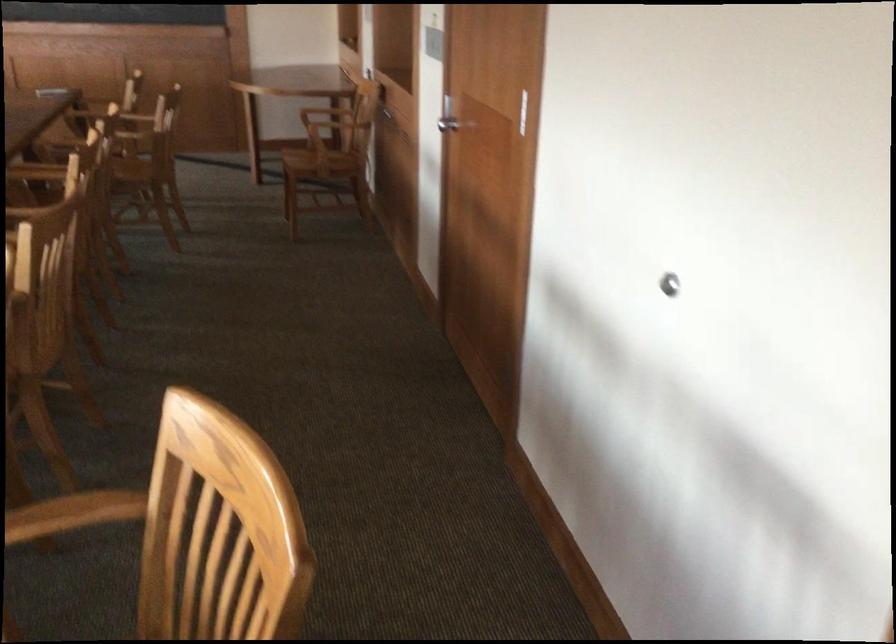
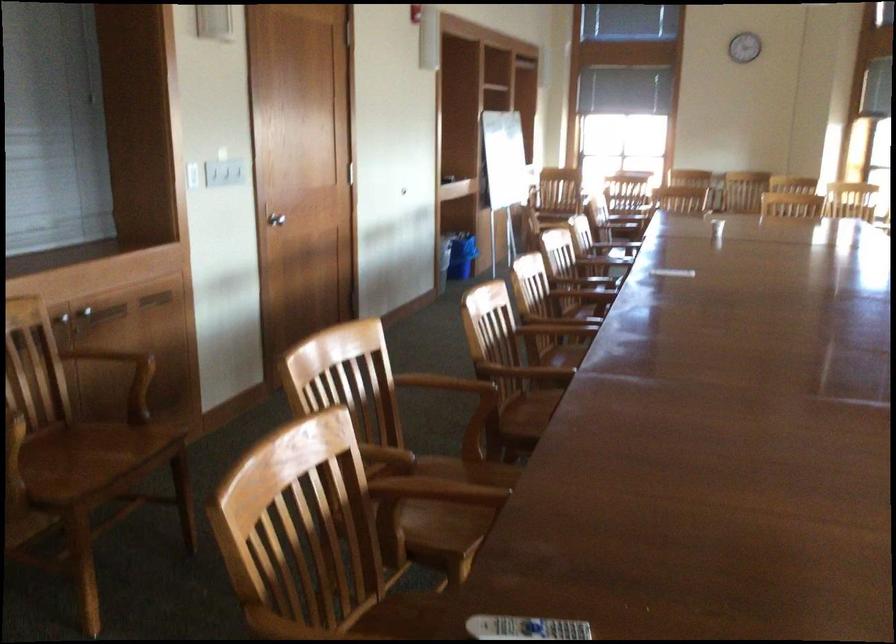
Question: I am providing you with two images of the same scene from different viewpoints. After the viewpoint changes to image2, which objects are now occluded?

Choices:
 (A) silver wall stop
 (B) silver door handle
 (C) blue salt container
 (D) cabinet handle

Answer: (A)